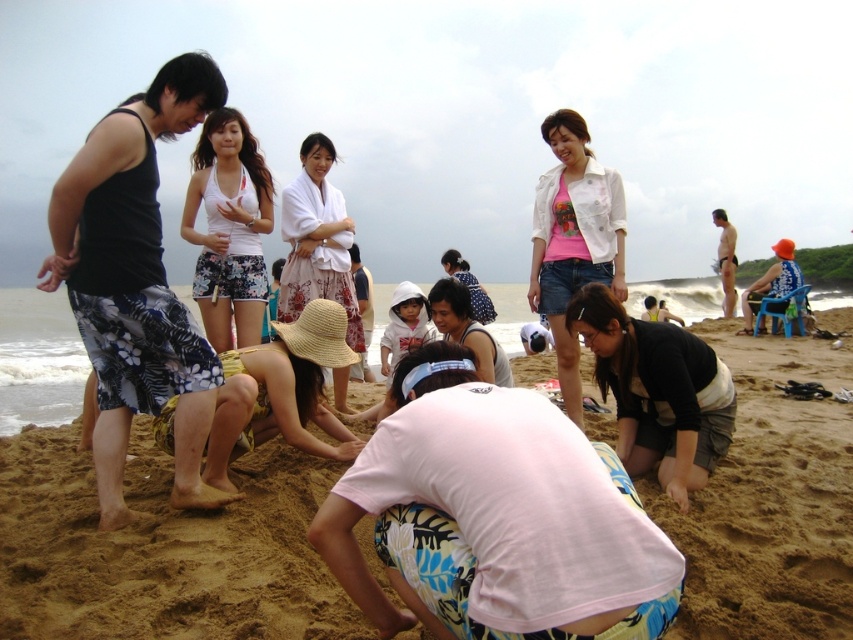
Question: Is pink cotton shirt at center in front of white cotton hat at center?

Choices:
 (A) no
 (B) yes

Answer: (A)

Question: Which point is closer to the camera?

Choices:
 (A) (459, 324)
 (B) (699, 401)
 (C) (576, 365)

Answer: (B)

Question: Which object appears farthest from the camera in this image?

Choices:
 (A) white cotton robe at center
 (B) white cotton hat at center
 (C) black cotton shirt at lower center
 (D) pink cotton shirt at center

Answer: (A)

Question: Is the position of black cotton shirt at lower center less distant than that of pink cotton shirt at center?

Choices:
 (A) yes
 (B) no

Answer: (A)

Question: Estimate the real-world distances between objects in this image. Which object is closer to the white cotton hoodie at center?

Choices:
 (A) brown sandy beach at center
 (B) white cotton hat at center
 (C) pink cotton shirt at center

Answer: (A)

Question: Can you confirm if pink cotton shirt at center is positioned above white cotton hat at center?

Choices:
 (A) yes
 (B) no

Answer: (A)